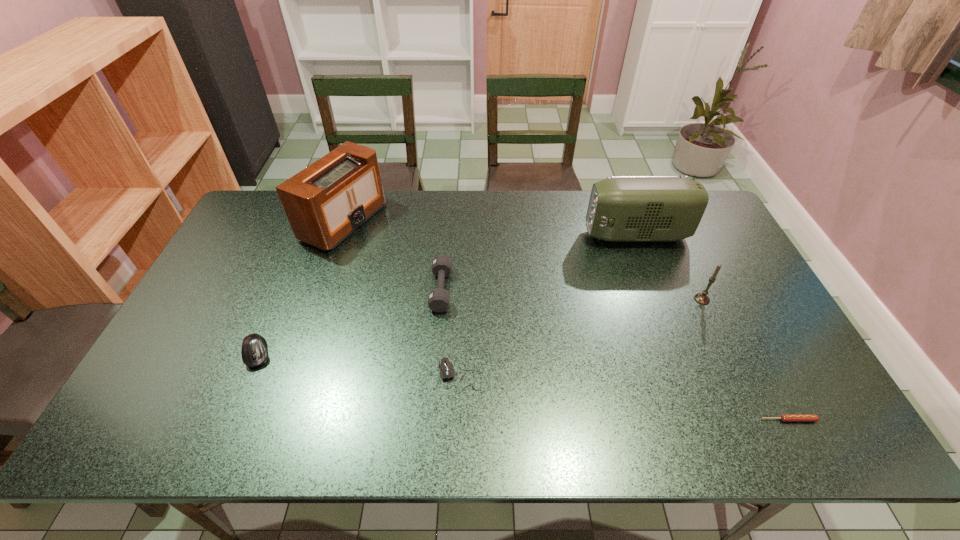
Select which object is the fifth closest to the right radio_receiver. Please provide its 2D coordinates. Your answer should be formatted as a tuple, i.e. [(x, y)], where the tuple contains the x and y coordinates of a point satisfying the conditions above.

[(327, 201)]

You are a GUI agent. You are given a task and a screenshot of the screen. Output one action in this format:
    pyautogui.click(x=<x>, y=<y>)
    Task: Click on the free space in the image that satisfies the following two spatial constraints: 1. on the front-facing side of the fifth shortest object; 2. on the right side of the right radio_receiver
    
    Given the screenshot: What is the action you would take?
    pyautogui.click(x=660, y=299)

At what (x,y) coordinates should I click in order to perform the action: click on vacant space that satisfies the following two spatial constraints: 1. on the front-facing side of the right radio_receiver; 2. on the left side of the sausage. Please return your answer as a coordinate pair (x, y). This screenshot has height=540, width=960. Looking at the image, I should click on (706, 420).

At what (x,y) coordinates should I click in order to perform the action: click on free space that satisfies the following two spatial constraints: 1. on the back side of the third tallest object; 2. on the left side of the taller computer mouse. Please return your answer as a coordinate pair (x, y). The image size is (960, 540). Looking at the image, I should click on (279, 299).

Find the location of a particular element. vacant space that satisfies the following two spatial constraints: 1. on the front-facing side of the right radio_receiver; 2. on the front side of the taller computer mouse is located at coordinates (681, 354).